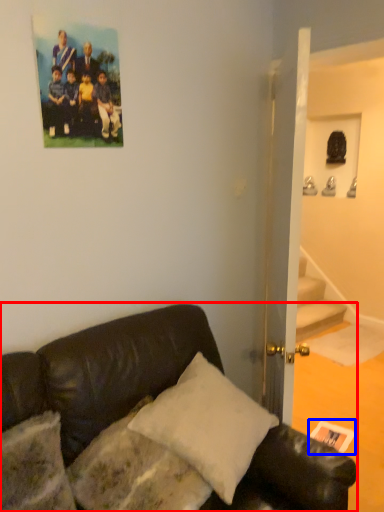
Question: Which of the following is the farthest to the observer, studio couch (highlighted by a red box) or postcard (highlighted by a blue box)?

Choices:
 (A) studio couch
 (B) postcard

Answer: (B)